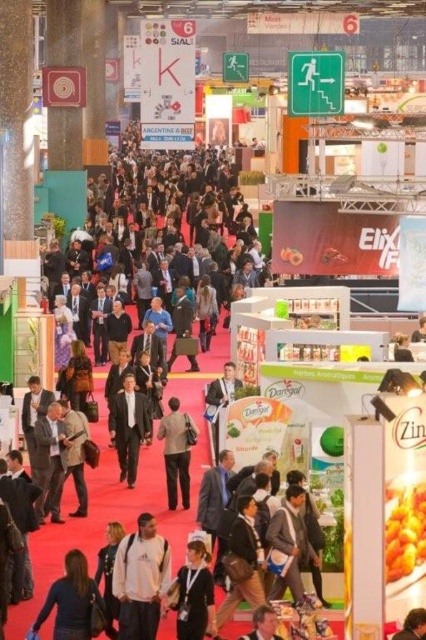
You are standing in the exhibition hall and want to move from point A to point B. Point A is located at coordinate point (x=135, y=609) and point B is at coordinate point (x=109, y=416). Which point is closer to you as you stand at the starting position?

Point A at coordinate point (x=135, y=609) is closer to you than point B at coordinate point (x=109, y=416).

You are a fashion designer attending the exhibition and notice two leather jackets displayed. The dark brown leather jacket at lower left and the light brown leather jacket at center. Which one is smaller?

The dark brown leather jacket at lower left is smaller than the light brown leather jacket at center.

You are a photographer standing at the entrance of the exhibition hall. You want to take a clear photo of the dark brown leather jacket at lower left. Considering your camera can focus up to 40 meters, will you be able to capture it clearly?

The dark brown leather jacket at lower left is 39.76 meters away from the camera, which is within the camera focus range of up to 40 meters. Therefore, you can capture it clearly.